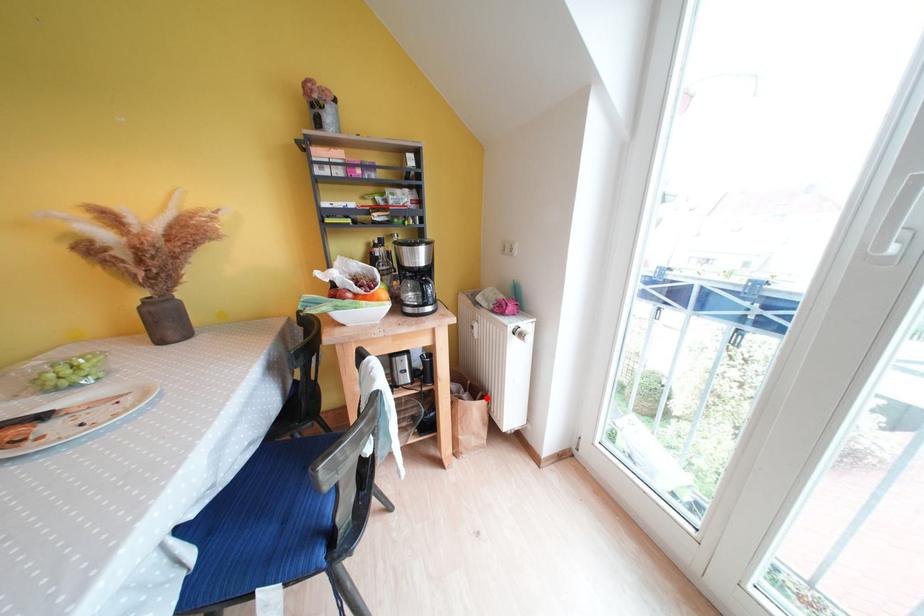
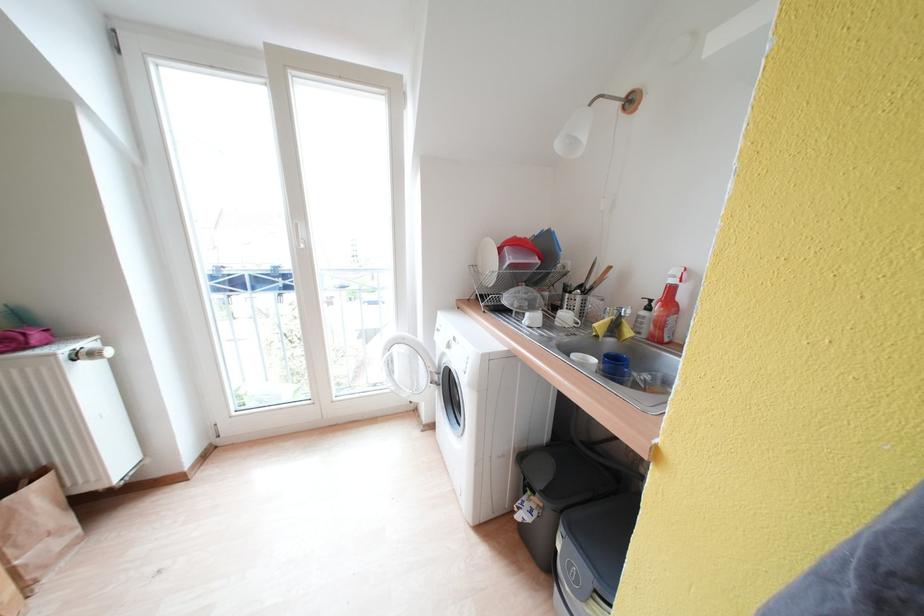
Find the pixel in the second image that matches the highlighted location in the first image.

(30, 485)